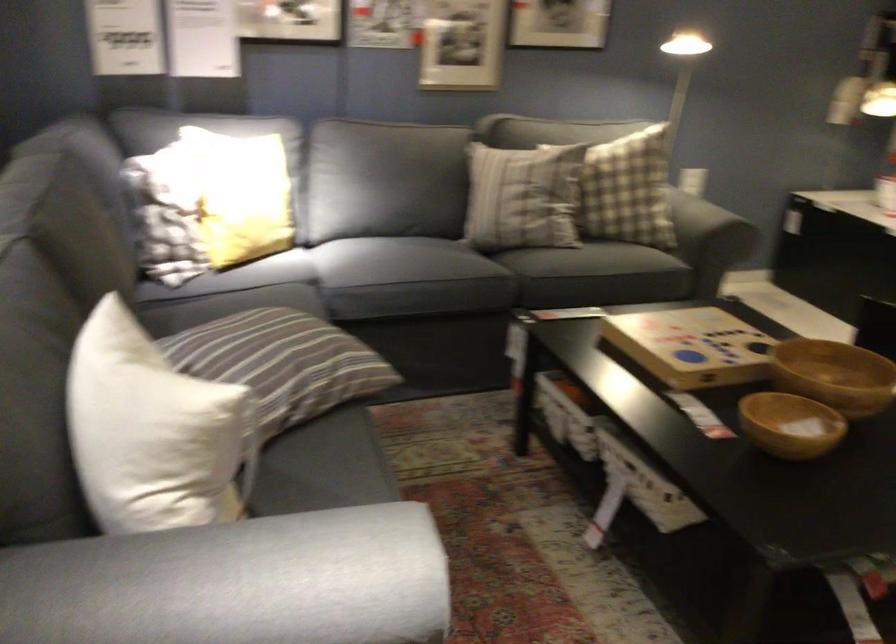
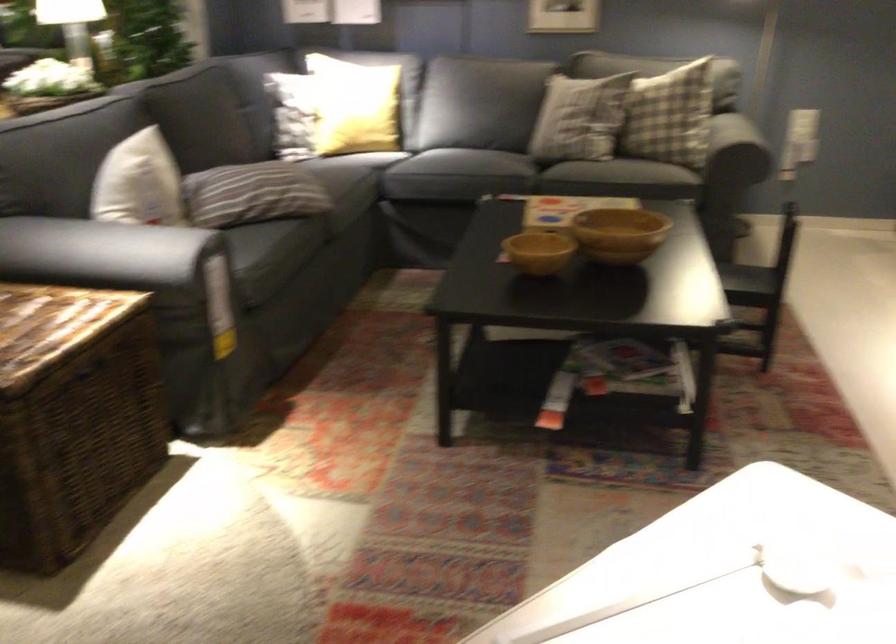
In the second image, find the point that corresponds to (x=194, y=402) in the first image.

(139, 183)